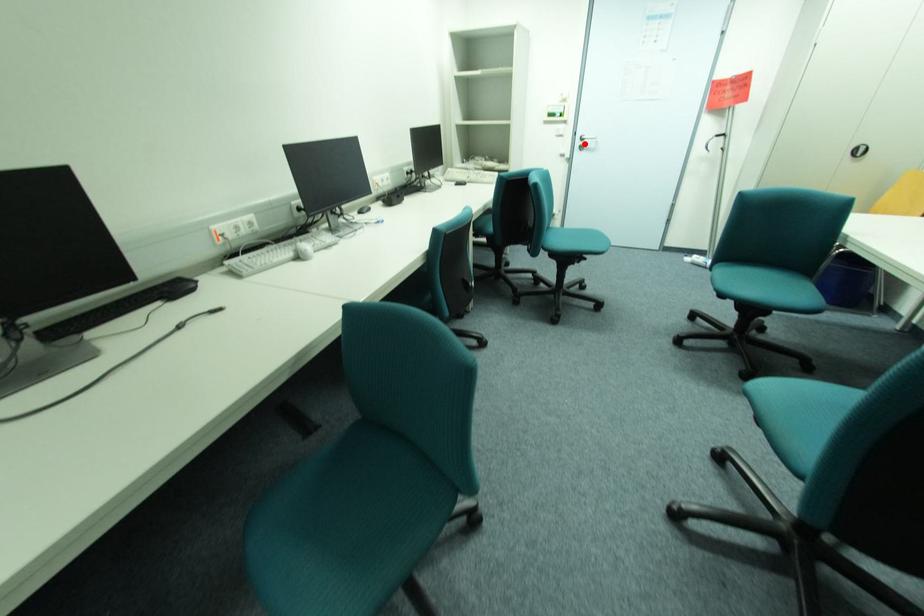
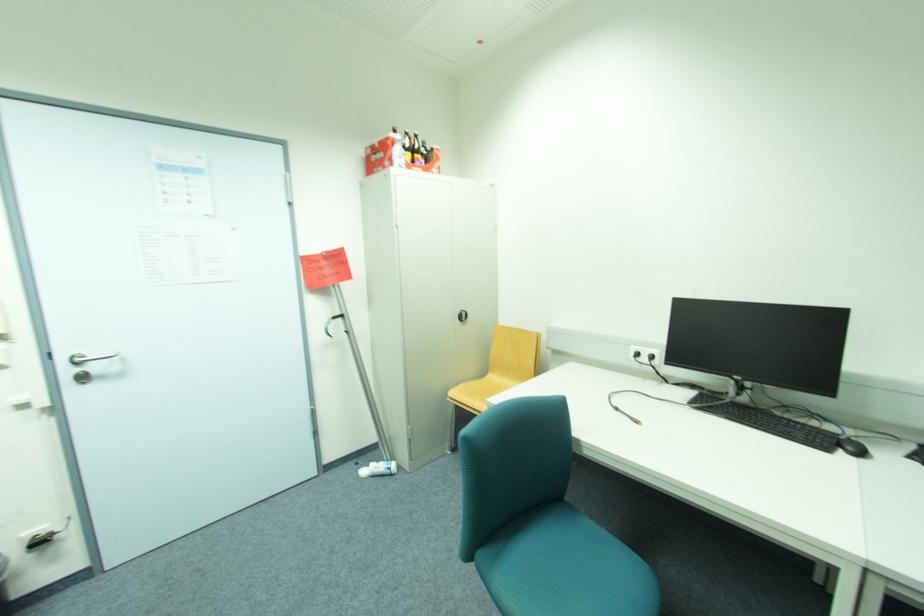
Find the pixel in the second image that matches the highlighted location in the first image.

(74, 371)